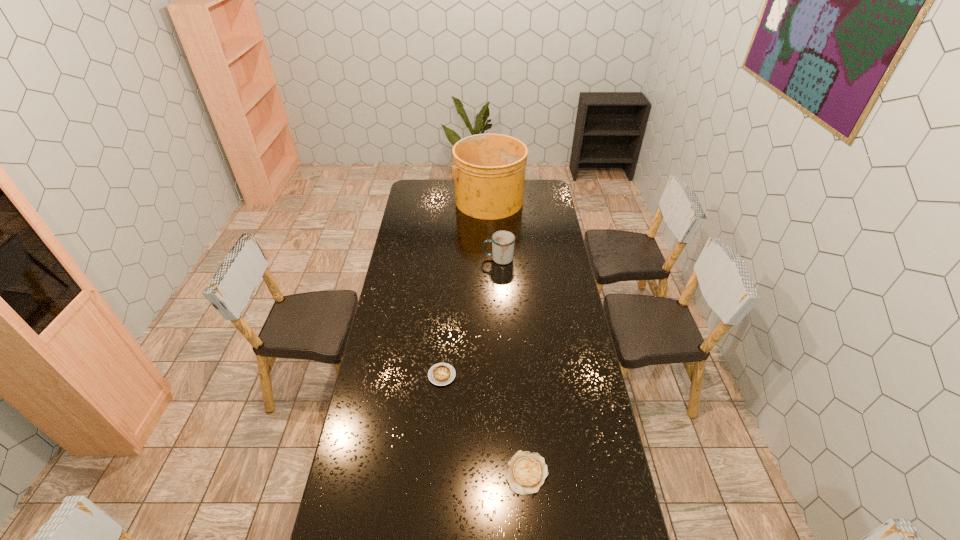
The height and width of the screenshot is (540, 960). What are the coordinates of `vacant area situated on the handle side of the mug` in the screenshot? It's located at (473, 259).

The width and height of the screenshot is (960, 540). I want to click on vacant space located 0.320m on the handle side of the mug, so click(x=420, y=259).

Locate an element on the screen. vacant space located on the front of the farther quiche is located at coordinates (436, 461).

Find the location of a particular element. The width and height of the screenshot is (960, 540). vacant space situated on the left of the nearest object is located at coordinates (450, 472).

Where is `object that is at the far edge`? The width and height of the screenshot is (960, 540). object that is at the far edge is located at coordinates (489, 169).

Where is `free spot at the far edge of the desktop`? free spot at the far edge of the desktop is located at coordinates (523, 197).

At what (x,y) coordinates should I click in order to perform the action: click on free region at the left edge of the desktop. Please return your answer as a coordinate pair (x, y). This screenshot has width=960, height=540. Looking at the image, I should click on (417, 202).

The height and width of the screenshot is (540, 960). I want to click on vacant area at the right edge, so (575, 330).

The image size is (960, 540). In the image, there is a desktop. In order to click on vacant space at the far left corner in this screenshot , I will do `click(414, 183)`.

Find the location of a particular element. The height and width of the screenshot is (540, 960). vacant point located between the third shortest object and the nearer quiche is located at coordinates (513, 366).